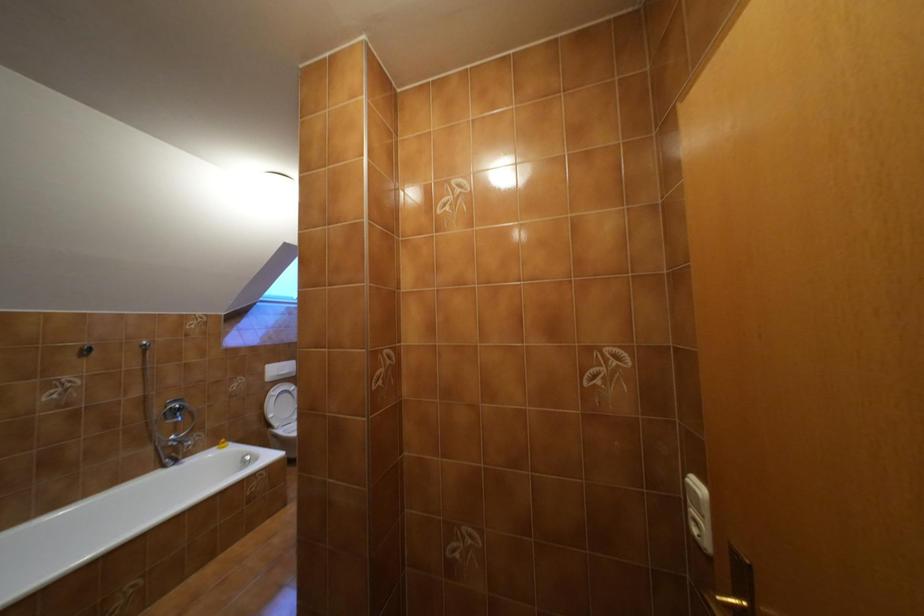
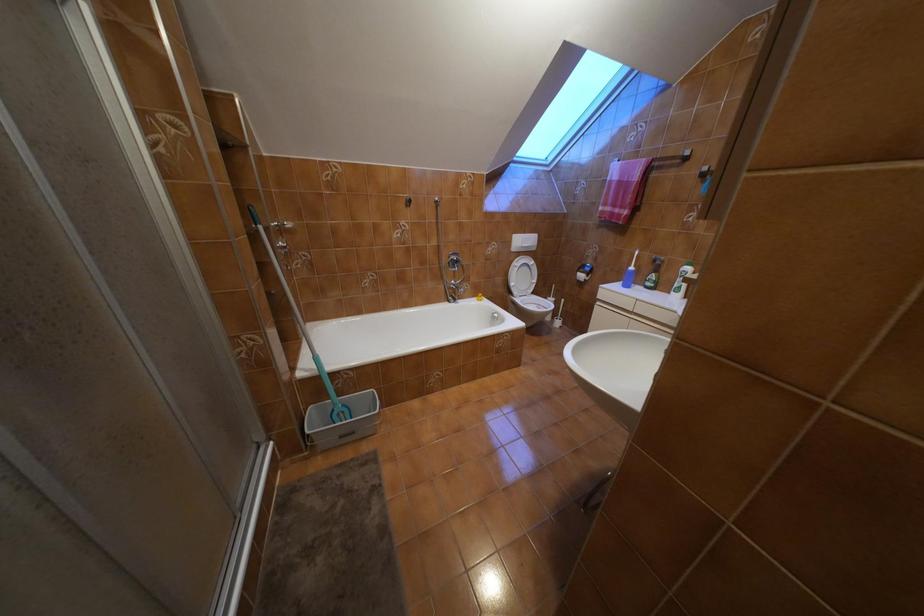
The first image is from the beginning of the video and the second image is from the end. How did the camera likely rotate when shooting the video?

The camera rotated toward left-down.